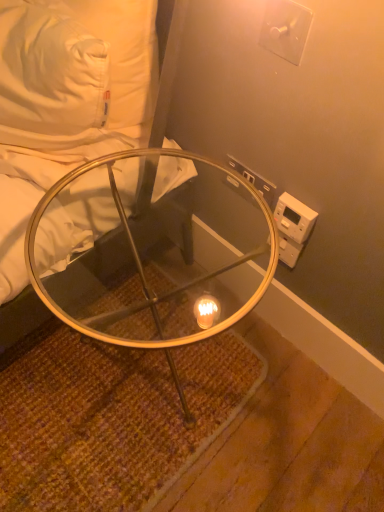
Question: From the image's perspective, is clear glass table at center located above or below white plastic electrical outlet at upper right, positioned as the first electric outlet in bottom-to-top order?

Choices:
 (A) below
 (B) above

Answer: (A)

Question: Is clear glass table at center spatially inside white plastic electrical outlet at upper right, positioned as the second electric outlet in top-to-bottom order, or outside of it?

Choices:
 (A) inside
 (B) outside

Answer: (B)

Question: Estimate the real-world distances between objects in this image. Which object is farther from the white plastic switch at upper right, which is the second electric outlet from back to front?

Choices:
 (A) clear glass table at lower left
 (B) clear glass table at center
 (C) white plastic electrical outlet at upper right, positioned as the first electric outlet in bottom-to-top order

Answer: (B)

Question: Based on their relative distances, which object is nearer to the clear glass table at center?

Choices:
 (A) white plastic electrical outlet at upper right, positioned as the second electric outlet in top-to-bottom order
 (B) white plastic switch at upper right, marked as the 2th electric outlet in a bottom-to-top arrangement
 (C) clear glass table at lower left

Answer: (C)